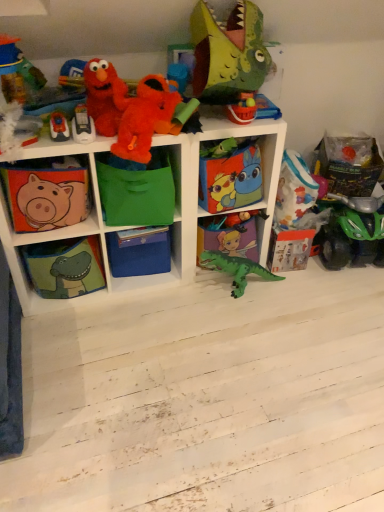
In order to click on vacant area in front of green fabric storage cubes at center, placed as the third shelf when sorted from left to right in this screenshot , I will do `click(155, 373)`.